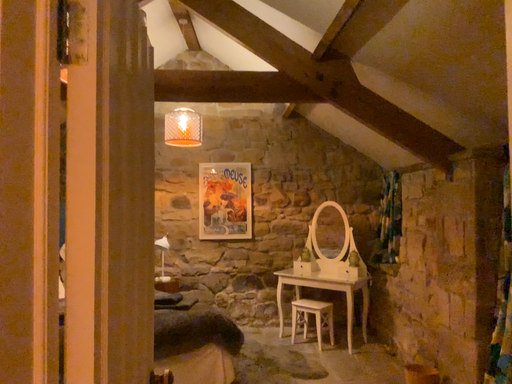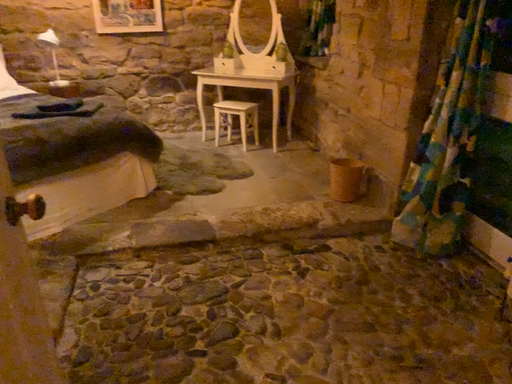
Question: How did the camera likely rotate when shooting the video?

Choices:
 (A) rotated left
 (B) rotated right

Answer: (B)